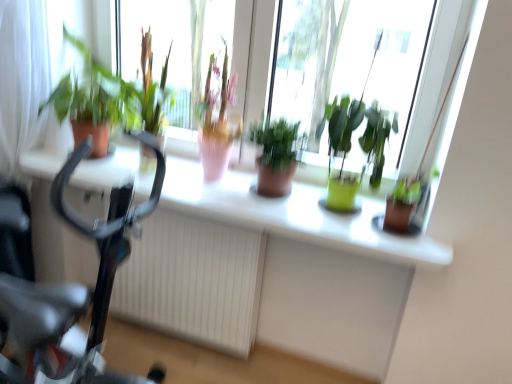
Question: From a real-world perspective, is green matte plant at left, arranged as the 1th houseplant when viewed from the left, below white textured radiator at center?

Choices:
 (A) yes
 (B) no

Answer: (B)

Question: Can you confirm if green matte plant at left, the fourth houseplant positioned from the right, is wider than white textured radiator at center?

Choices:
 (A) no
 (B) yes

Answer: (B)

Question: Is green matte plant at left, the fourth houseplant positioned from the right, taller than white textured radiator at center?

Choices:
 (A) yes
 (B) no

Answer: (B)

Question: Is green matte plant at left, arranged as the 1th houseplant when viewed from the left, closer to camera compared to white textured radiator at center?

Choices:
 (A) yes
 (B) no

Answer: (A)

Question: Is green matte plant at left, the fourth houseplant positioned from the right, bigger than white textured radiator at center?

Choices:
 (A) no
 (B) yes

Answer: (A)

Question: Is green matte plant at left, arranged as the 1th houseplant when viewed from the left, bigger or smaller than green matte pot at right, the 1th houseplant viewed from the right?

Choices:
 (A) big
 (B) small

Answer: (A)

Question: Is green matte plant at left, the fourth houseplant positioned from the right, taller or shorter than green matte pot at right, the 1th houseplant viewed from the right?

Choices:
 (A) tall
 (B) short

Answer: (A)

Question: From a real-world perspective, is green matte plant at left, arranged as the 1th houseplant when viewed from the left, physically located above or below green matte pot at right, the 1th houseplant viewed from the right?

Choices:
 (A) below
 (B) above

Answer: (B)

Question: In terms of width, does green matte plant at left, arranged as the 1th houseplant when viewed from the left, look wider or thinner when compared to green matte pot at right, the 1th houseplant viewed from the right?

Choices:
 (A) thin
 (B) wide

Answer: (B)

Question: Choose the correct answer: Is green matte plant at upper center inside black glossy bicycle at left or outside it?

Choices:
 (A) inside
 (B) outside

Answer: (B)

Question: Considering the positions of point pos(327,19) and point pos(39,374), is point pos(327,19) closer or farther from the camera than point pos(39,374)?

Choices:
 (A) closer
 (B) farther

Answer: (B)

Question: Based on their positions, is green matte plant at upper center located to the left or right of black glossy bicycle at left?

Choices:
 (A) left
 (B) right

Answer: (B)

Question: From the image's perspective, relative to black glossy bicycle at left, is green matte plant at upper center above or below?

Choices:
 (A) above
 (B) below

Answer: (A)

Question: Would you say green matte plant at left, arranged as the 1th houseplant when viewed from the left, is inside or outside matte brown pot at center, marked as the 2th houseplant in a left-to-right arrangement?

Choices:
 (A) outside
 (B) inside

Answer: (A)

Question: Looking at their shapes, would you say green matte plant at left, arranged as the 1th houseplant when viewed from the left, is wider or thinner than matte brown pot at center, marked as the 2th houseplant in a left-to-right arrangement?

Choices:
 (A) wide
 (B) thin

Answer: (A)